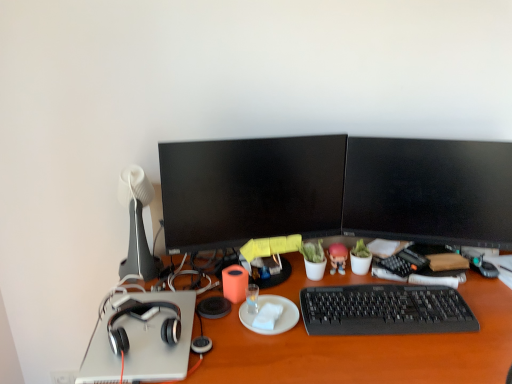
The width and height of the screenshot is (512, 384). What are the coordinates of `free spot behind white matte notepad at center` in the screenshot? It's located at (273, 288).